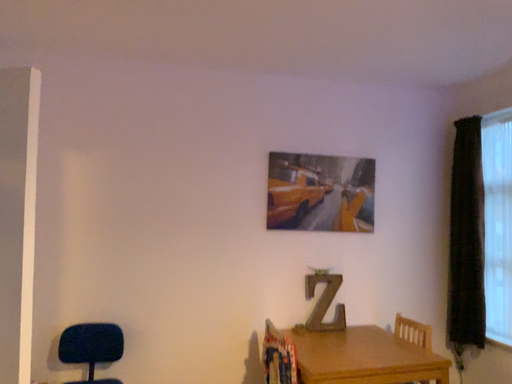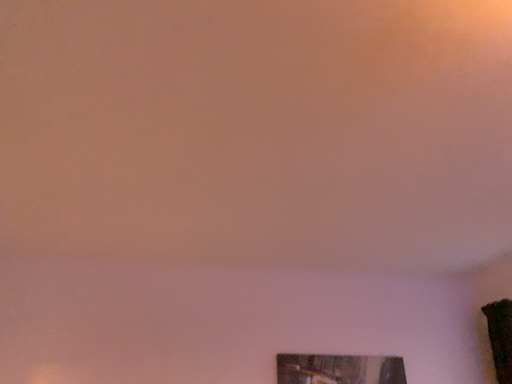
Question: How did the camera likely rotate when shooting the video?

Choices:
 (A) rotated downward
 (B) rotated upward

Answer: (B)